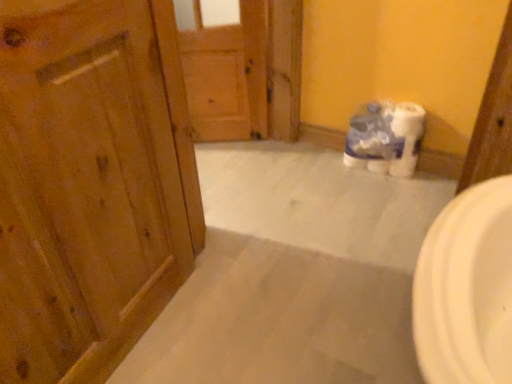
Question: In terms of height, does white plastic toilet paper at center look taller or shorter compared to wooden door at left, which is counted as the 2th door, starting from the back?

Choices:
 (A) tall
 (B) short

Answer: (B)

Question: From the image's perspective, is white plastic toilet paper at center positioned above or below wooden door at left, which is counted as the 2th door, starting from the back?

Choices:
 (A) below
 (B) above

Answer: (B)

Question: Which is nearer to the white plastic toilet paper at center?

Choices:
 (A) wooden door at left, which is counted as the 2th door, starting from the back
 (B) wooden door at center, which ranks as the first door in back-to-front order

Answer: (B)

Question: Which object is the closest to the wooden door at center, which ranks as the first door in back-to-front order?

Choices:
 (A) white plastic toilet paper at center
 (B) wooden door at left, the 1th door positioned from the front

Answer: (A)